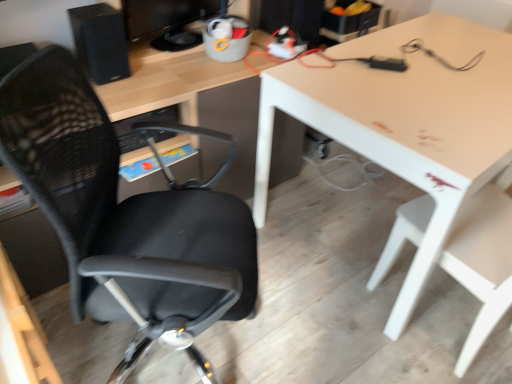
Question: Does black mesh office chair at left, the 2th chair when ordered from right to left, have a smaller size compared to matte black monitor at upper center?

Choices:
 (A) no
 (B) yes

Answer: (A)

Question: Is matte black monitor at upper center inside black mesh office chair at left, the 2th chair when ordered from right to left?

Choices:
 (A) yes
 (B) no

Answer: (B)

Question: From a real-world perspective, is black mesh office chair at left, the first chair viewed from the left, on top of matte black monitor at upper center?

Choices:
 (A) no
 (B) yes

Answer: (A)

Question: From a real-world perspective, is black mesh office chair at left, the first chair viewed from the left, physically below matte black monitor at upper center?

Choices:
 (A) no
 (B) yes

Answer: (B)

Question: Considering the relative sizes of black mesh office chair at left, the first chair viewed from the left, and matte black monitor at upper center in the image provided, is black mesh office chair at left, the first chair viewed from the left, thinner than matte black monitor at upper center?

Choices:
 (A) no
 (B) yes

Answer: (A)

Question: Is white plastic chair at lower right, which appears as the 1th chair when viewed from the right, in front of or behind matte black monitor at upper center in the image?

Choices:
 (A) front
 (B) behind

Answer: (A)

Question: Is point (380, 268) positioned closer to the camera than point (193, 16)?

Choices:
 (A) closer
 (B) farther

Answer: (A)

Question: From the image's perspective, is white plastic chair at lower right, the second chair positioned from the left, above or below matte black monitor at upper center?

Choices:
 (A) above
 (B) below

Answer: (B)

Question: From a real-world perspective, is white plastic chair at lower right, the second chair positioned from the left, above or below matte black monitor at upper center?

Choices:
 (A) below
 (B) above

Answer: (A)

Question: In terms of width, does black matte speaker at upper left look wider or thinner when compared to white plastic chair at lower right, the second chair positioned from the left?

Choices:
 (A) thin
 (B) wide

Answer: (A)

Question: From their relative heights in the image, would you say black matte speaker at upper left is taller or shorter than white plastic chair at lower right, which appears as the 1th chair when viewed from the right?

Choices:
 (A) short
 (B) tall

Answer: (A)

Question: Is point (102, 21) positioned closer to the camera than point (500, 276)?

Choices:
 (A) farther
 (B) closer

Answer: (A)

Question: Relative to white plastic chair at lower right, the second chair positioned from the left, is black matte speaker at upper left in front or behind?

Choices:
 (A) behind
 (B) front

Answer: (A)

Question: Does point (58, 193) appear closer or farther from the camera than point (457, 228)?

Choices:
 (A) closer
 (B) farther

Answer: (A)

Question: From the image's perspective, is black mesh office chair at left, the 2th chair when ordered from right to left, located above or below white plastic chair at lower right, the second chair positioned from the left?

Choices:
 (A) below
 (B) above

Answer: (B)